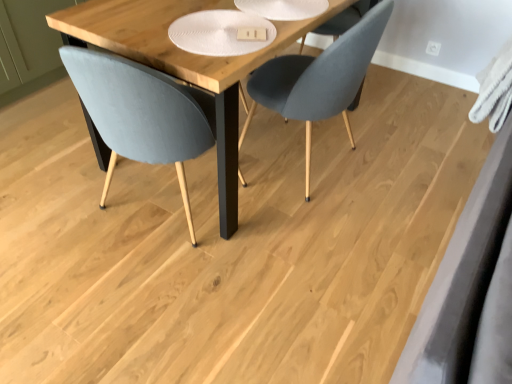
Where is `wooden table at center`? wooden table at center is located at coordinates (184, 63).

Identify the location of velvet grey chair at center, the first chair in the right-to-left sequence. The width and height of the screenshot is (512, 384). click(319, 78).

Considering the sizes of velvet grey chair at center, the first chair in the right-to-left sequence, and matte gray chair at left, which is the second chair from right to left, in the image, is velvet grey chair at center, the first chair in the right-to-left sequence, bigger or smaller than matte gray chair at left, which is the second chair from right to left,?

Clearly, velvet grey chair at center, the first chair in the right-to-left sequence, is larger in size than matte gray chair at left, which is the second chair from right to left.

From a real-world perspective, which is physically above, velvet grey chair at center, acting as the second chair starting from the left, or matte gray chair at left, which is counted as the first chair, starting from the left?

In real-world perspective, matte gray chair at left, which is counted as the first chair, starting from the left, is above.

Looking at this image, considering the relative positions of velvet grey chair at center, acting as the second chair starting from the left, and matte gray chair at left, which is counted as the first chair, starting from the left, in the image provided, is velvet grey chair at center, acting as the second chair starting from the left, to the left or to the right of matte gray chair at left, which is counted as the first chair, starting from the left,?

In the image, velvet grey chair at center, acting as the second chair starting from the left, appears on the right side of matte gray chair at left, which is counted as the first chair, starting from the left.

Which object is closer to the camera, velvet grey chair at center, acting as the second chair starting from the left, or matte gray chair at left, which is counted as the first chair, starting from the left?

matte gray chair at left, which is counted as the first chair, starting from the left, is more forward.

Identify the location of the 1st chair below the wooden table at center (from the image's perspective). (319, 78).

Between velvet grey chair at center, acting as the second chair starting from the left, and wooden table at center, which one has less height?

Standing shorter between the two is wooden table at center.

Is velvet grey chair at center, acting as the second chair starting from the left, oriented towards wooden table at center?

Yes, velvet grey chair at center, acting as the second chair starting from the left, is turned towards wooden table at center.

From a real-world perspective, is wooden table at center physically located above or below velvet grey chair at center, the first chair in the right-to-left sequence?

wooden table at center is situated lower than velvet grey chair at center, the first chair in the right-to-left sequence, in the real world.

Find the location of a particular element. The image size is (512, 384). table in front of the velvet grey chair at center, the first chair in the right-to-left sequence is located at coordinates (184, 63).

Where is `chair lying below the velvet grey chair at center, the first chair in the right-to-left sequence (from the image's perspective)`? chair lying below the velvet grey chair at center, the first chair in the right-to-left sequence (from the image's perspective) is located at coordinates (142, 113).

Considering the sizes of objects matte gray chair at left, which is counted as the first chair, starting from the left, and velvet grey chair at center, the first chair in the right-to-left sequence, in the image provided, who is smaller, matte gray chair at left, which is counted as the first chair, starting from the left, or velvet grey chair at center, the first chair in the right-to-left sequence,?

matte gray chair at left, which is counted as the first chair, starting from the left, is smaller.

Looking at this image, does matte gray chair at left, which is the second chair from right to left, have a lesser width compared to velvet grey chair at center, acting as the second chair starting from the left?

No.

Is matte gray chair at left, which is counted as the first chair, starting from the left, behind velvet grey chair at center, the first chair in the right-to-left sequence?

No.

Between point (71, 57) and point (254, 56), which one is positioned in front?

The point (71, 57) is closer.

Is matte gray chair at left, which is counted as the first chair, starting from the left, positioned with its back to wooden table at center?

Absolutely, matte gray chair at left, which is counted as the first chair, starting from the left, is directed away from wooden table at center.

Which is more to the right, matte gray chair at left, which is the second chair from right to left, or wooden table at center?

wooden table at center is more to the right.

Which object is positioned more to the right, wooden table at center or matte gray chair at left, which is counted as the first chair, starting from the left?

Positioned to the right is wooden table at center.

From the image's perspective, is wooden table at center positioned above or below matte gray chair at left, which is counted as the first chair, starting from the left?

Clearly, from the image's perspective, wooden table at center is above matte gray chair at left, which is counted as the first chair, starting from the left.

Is point (111, 6) positioned in front of point (81, 94)?

No, it is not.

Locate an element on the screen. chair below the velvet grey chair at center, the first chair in the right-to-left sequence (from the image's perspective) is located at coordinates (142, 113).

Where is `table that appears above the velvet grey chair at center, the first chair in the right-to-left sequence (from the image's perspective)`? table that appears above the velvet grey chair at center, the first chair in the right-to-left sequence (from the image's perspective) is located at coordinates (184, 63).

Which object lies further to the anchor point matte gray chair at left, which is counted as the first chair, starting from the left, wooden table at center or velvet grey chair at center, the first chair in the right-to-left sequence?

velvet grey chair at center, the first chair in the right-to-left sequence, is positioned further to the anchor matte gray chair at left, which is counted as the first chair, starting from the left.

Which object lies further to the anchor point velvet grey chair at center, acting as the second chair starting from the left, wooden table at center or matte gray chair at left, which is counted as the first chair, starting from the left?

Among the two, matte gray chair at left, which is counted as the first chair, starting from the left, is located further to velvet grey chair at center, acting as the second chair starting from the left.

Looking at the image, which one is located further to wooden table at center, velvet grey chair at center, the first chair in the right-to-left sequence, or matte gray chair at left, which is the second chair from right to left?

velvet grey chair at center, the first chair in the right-to-left sequence.

When comparing their distances from wooden table at center, does matte gray chair at left, which is the second chair from right to left, or velvet grey chair at center, acting as the second chair starting from the left, seem closer?

matte gray chair at left, which is the second chair from right to left, is positioned closer to the anchor wooden table at center.

Based on their spatial positions, is matte gray chair at left, which is counted as the first chair, starting from the left, or wooden table at center closer to velvet grey chair at center, acting as the second chair starting from the left?

wooden table at center is positioned closer to the anchor velvet grey chair at center, acting as the second chair starting from the left.

Based on their spatial positions, is velvet grey chair at center, the first chair in the right-to-left sequence, or wooden table at center closer to matte gray chair at left, which is the second chair from right to left?

wooden table at center.

The image size is (512, 384). Identify the location of table between matte gray chair at left, which is the second chair from right to left, and velvet grey chair at center, the first chair in the right-to-left sequence. (184, 63).